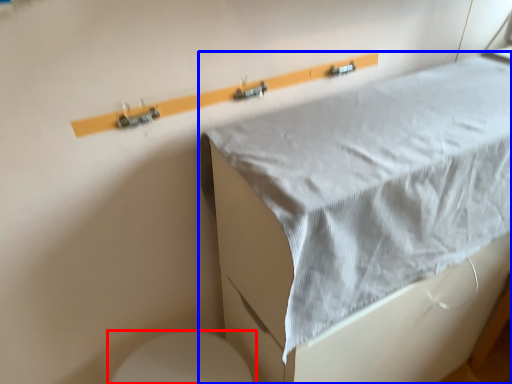
Question: Which of the following is the closest to the observer, toilet (highlighted by a red box) or furniture (highlighted by a blue box)?

Choices:
 (A) toilet
 (B) furniture

Answer: (B)